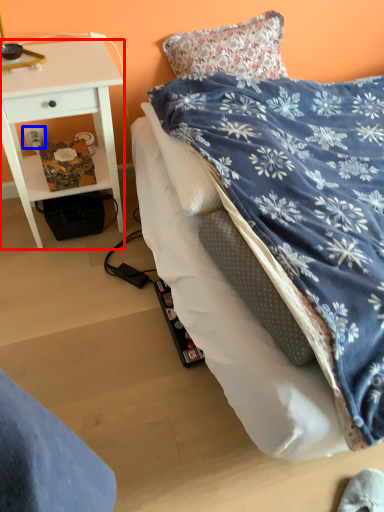
Question: Which point is closer to the camera, desk (highlighted by a red box) or power outlet (highlighted by a blue box)?

Choices:
 (A) desk
 (B) power outlet

Answer: (A)